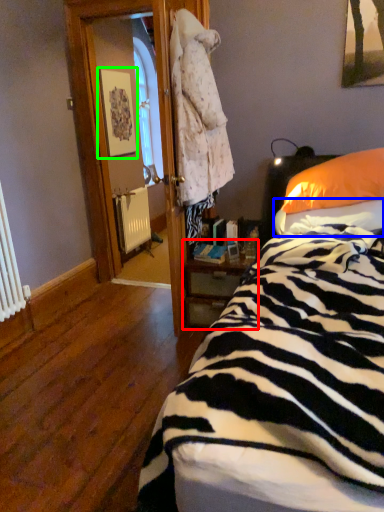
Question: Based on their relative distances, which object is nearer to nightstand (highlighted by a red box)? Choose from sheet (highlighted by a blue box) and picture frame (highlighted by a green box).

Choices:
 (A) sheet
 (B) picture frame

Answer: (A)